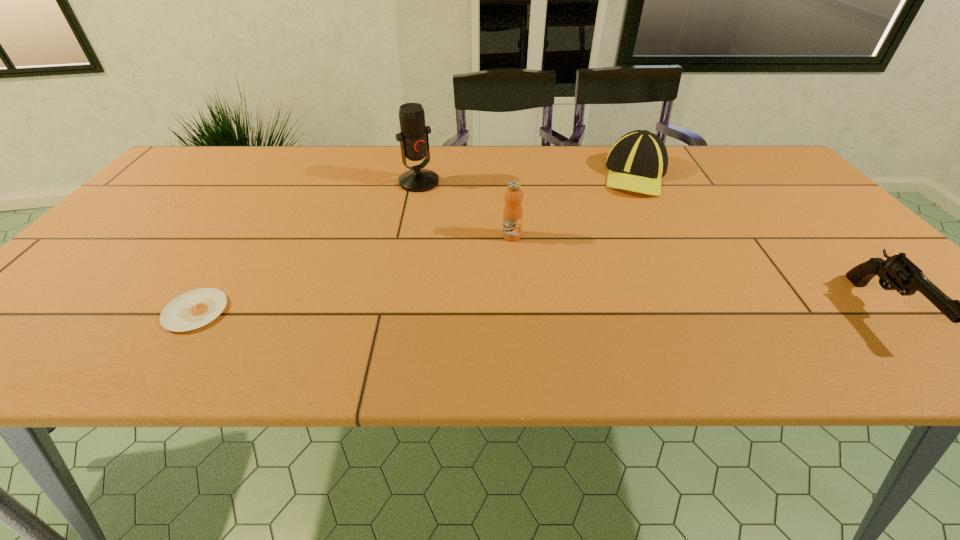
The height and width of the screenshot is (540, 960). Identify the location of free spot between the orange juice and the microphone. (466, 209).

Identify the location of vacant point located between the egg yolk and the rightmost object. The width and height of the screenshot is (960, 540). (540, 311).

Where is `free spot between the baseball cap and the third object from left to right`? free spot between the baseball cap and the third object from left to right is located at coordinates (573, 206).

This screenshot has height=540, width=960. I want to click on vacant area that lies between the rightmost object and the third object from right to left, so click(697, 274).

The image size is (960, 540). In order to click on blank region between the egg yolk and the rightmost object in this screenshot , I will do [540, 311].

This screenshot has height=540, width=960. In order to click on unoccupied position between the second object from right to left and the rightmost object in this screenshot , I will do `click(759, 243)`.

Find the location of a particular element. vacant space that's between the egg yolk and the third object from left to right is located at coordinates (353, 274).

At what (x,y) coordinates should I click in order to perform the action: click on free spot between the third nearest object and the gun. Please return your answer as a coordinate pair (x, y). Looking at the image, I should click on (697, 274).

Find the location of a particular element. free spot between the rightmost object and the microphone is located at coordinates (651, 247).

This screenshot has height=540, width=960. In order to click on empty space between the fourth object from right to left and the orange juice in this screenshot , I will do `click(466, 209)`.